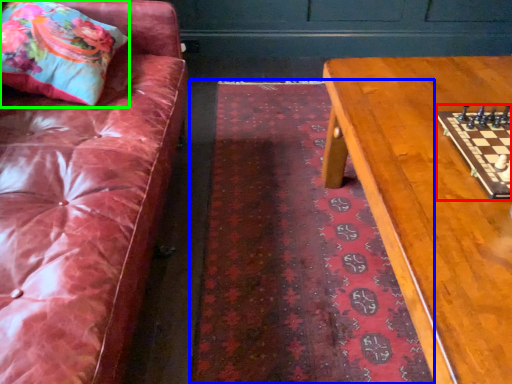
Question: Which is nearer to the board game (highlighted by a red box)? mat (highlighted by a blue box) or throw pillow (highlighted by a green box).

Choices:
 (A) mat
 (B) throw pillow

Answer: (A)